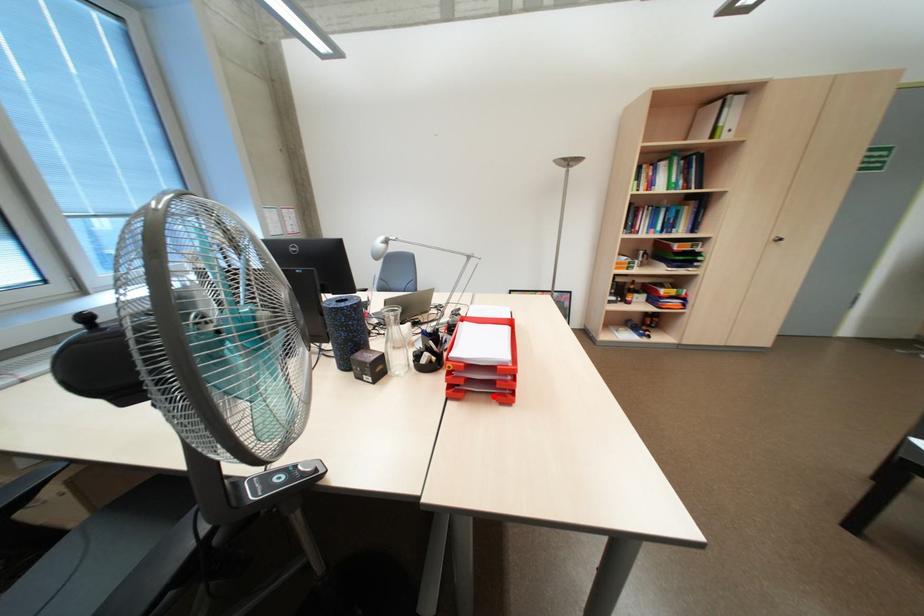
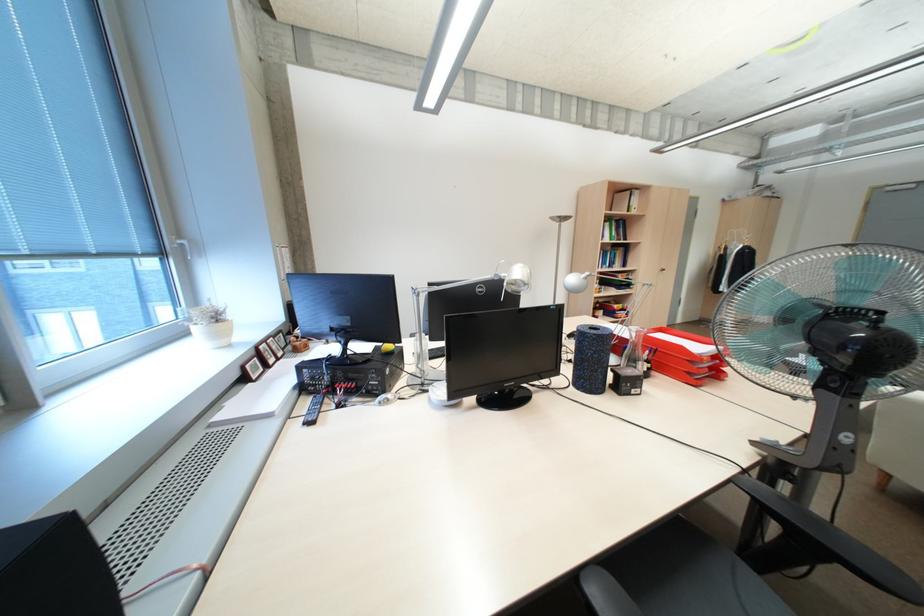
Locate, in the second image, the point that corresponds to the highlighted location in the first image.

(716, 379)